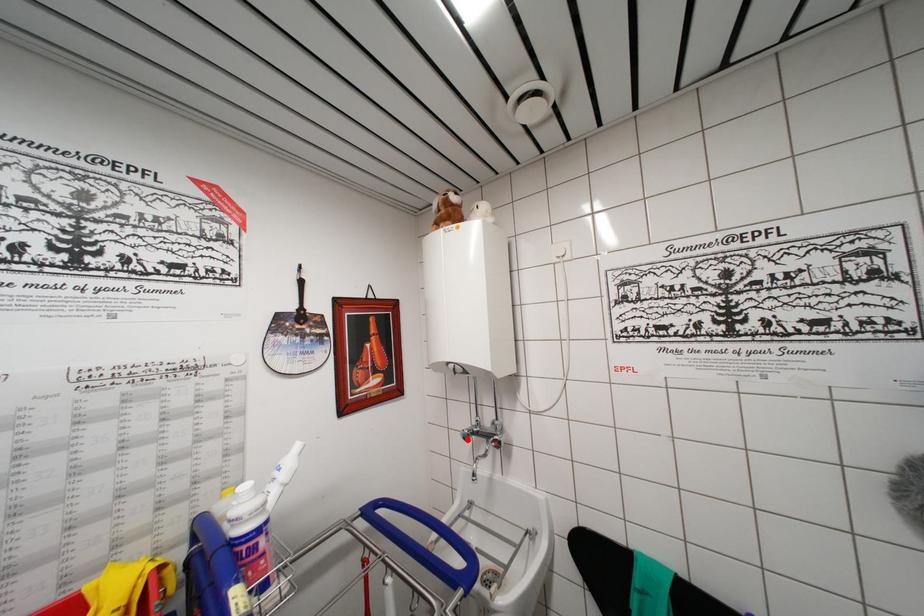
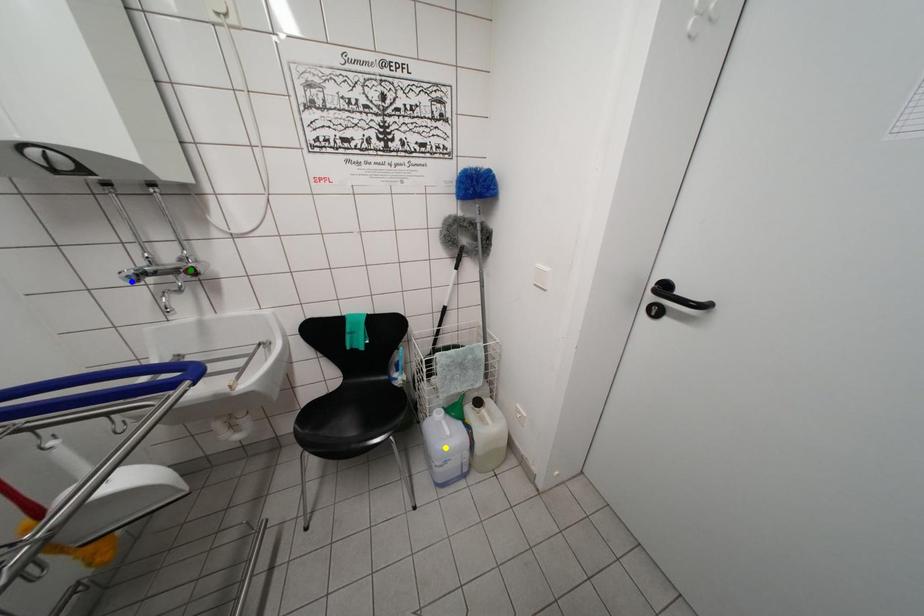
Question: I am providing you with two images of the same scene from different viewpoints. A red point is marked on the first image. You are given multiple points on the second image. Can you choose the point in image 2 that corresponds to the point in image 1?

Choices:
 (A) blue point
 (B) green point
 (C) yellow point

Answer: (A)